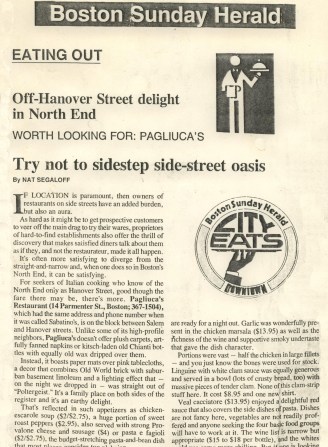
You are a GUI agent. You are given a task and a screenshot of the screen. Output one action in this format:
    pyautogui.click(x=<x>, y=<y>)
    Task: Click on the serving platter
    The height and width of the screenshot is (447, 328).
    Given the screenshot: What is the action you would take?
    pyautogui.click(x=257, y=67)